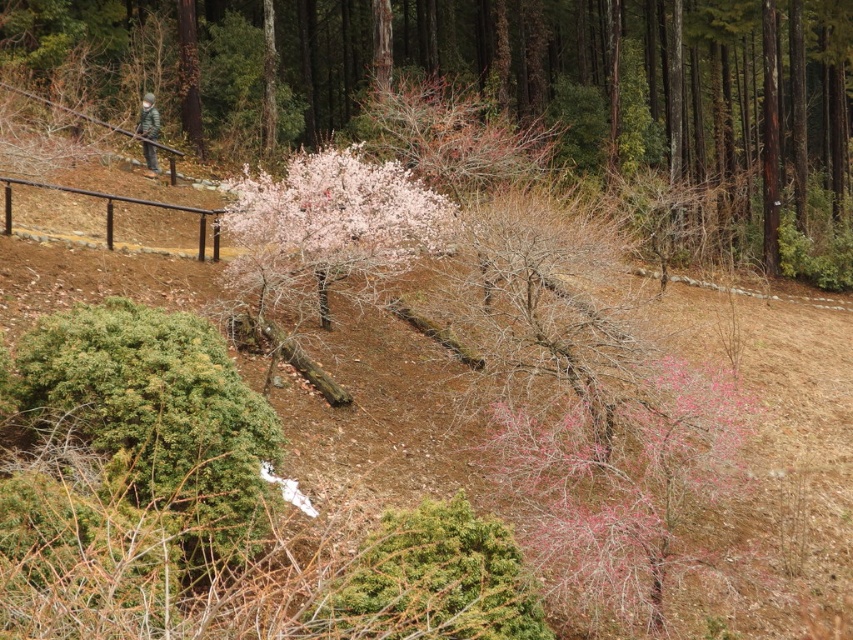
Can you confirm if pink textured bush at center is positioned to the right of camouflage fabric person at upper left?

Correct, you'll find pink textured bush at center to the right of camouflage fabric person at upper left.

Who is higher up, pink textured bush at center or camouflage fabric person at upper left?

pink textured bush at center

Describe the element at coordinates (662, 86) in the screenshot. I see `pink textured bush at center` at that location.

This screenshot has width=853, height=640. Find the location of `pink textured bush at center`. pink textured bush at center is located at coordinates (662, 86).

Between pink matte tree at center and camouflage fabric person at upper left, which one appears on the left side from the viewer's perspective?

From the viewer's perspective, camouflage fabric person at upper left appears more on the left side.

Based on the photo, does pink matte tree at center appear on the right side of camouflage fabric person at upper left?

Indeed, pink matte tree at center is positioned on the right side of camouflage fabric person at upper left.

Does point (321, 202) lie in front of point (152, 148)?

Yes.

I want to click on pink matte tree at center, so click(329, 230).

This screenshot has height=640, width=853. In order to click on pink textured bush at center in this screenshot , I will do tap(662, 86).

Between pink textured bush at center and pink matte tree at center, which one is positioned lower?

Positioned lower is pink matte tree at center.

You are a GUI agent. You are given a task and a screenshot of the screen. Output one action in this format:
    pyautogui.click(x=<x>, y=<y>)
    Task: Click on the pink textured bush at center
    The height and width of the screenshot is (640, 853).
    Given the screenshot: What is the action you would take?
    pyautogui.click(x=662, y=86)